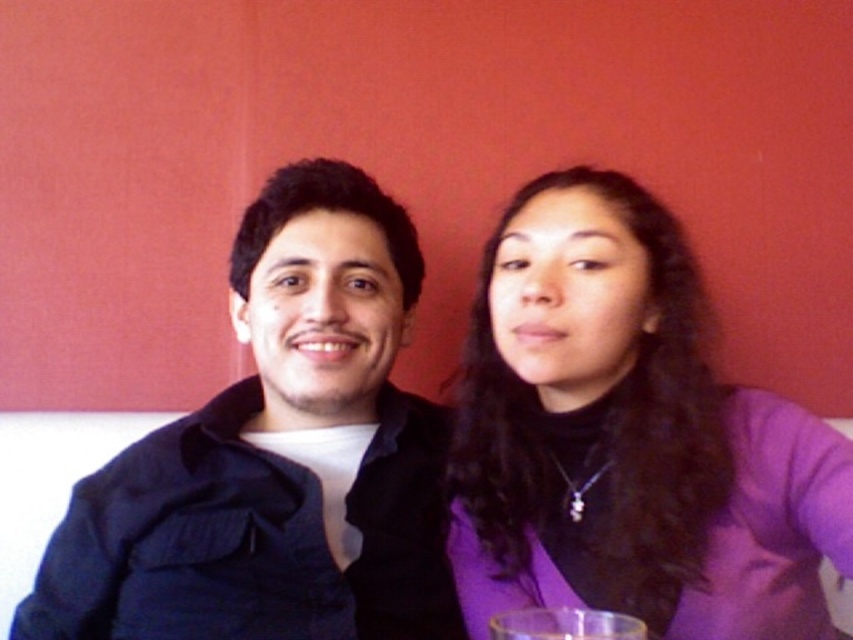
Question: Can you confirm if purple matte sweater at center is bigger than matte black shirt at center?

Choices:
 (A) yes
 (B) no

Answer: (B)

Question: Estimate the real-world distances between objects in this image. Which object is farther from the transparent glass at lower center?

Choices:
 (A) matte black shirt at center
 (B) purple matte sweater at center

Answer: (A)

Question: Can you confirm if purple matte sweater at center is positioned below transparent glass at lower center?

Choices:
 (A) no
 (B) yes

Answer: (A)

Question: Does matte black shirt at center have a lesser width compared to transparent glass at lower center?

Choices:
 (A) no
 (B) yes

Answer: (A)

Question: Among these points, which one is nearest to the camera?

Choices:
 (A) (699, 493)
 (B) (498, 621)

Answer: (B)

Question: Which of the following is the farthest from the observer?

Choices:
 (A) (508, 627)
 (B) (398, 422)

Answer: (B)